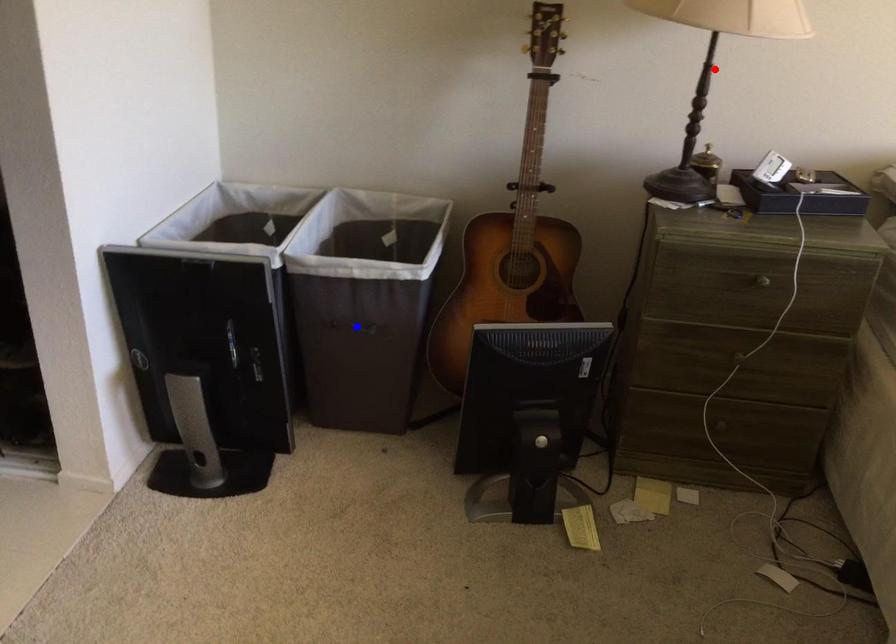
Question: Two points are marked on the image. Which point is closer to the camera?

Choices:
 (A) Blue point is closer.
 (B) Red point is closer.

Answer: (B)